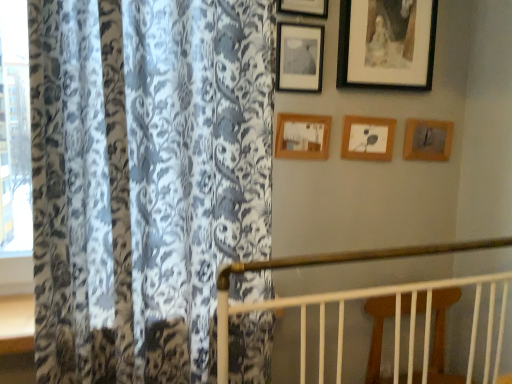
Question: Is wooden picture frame at upper center, the fifth picture frame when ordered from right to left, with wooden picture frame at upper center, the 4th picture frame when ordered from left to right?

Choices:
 (A) no
 (B) yes

Answer: (A)

Question: Is the depth of wooden picture frame at upper center, the fifth picture frame when ordered from right to left, less than that of wooden picture frame at upper center, positioned as the 3th picture frame in right-to-left order?

Choices:
 (A) yes
 (B) no

Answer: (A)

Question: Is wooden picture frame at upper center, which is the second picture frame from left to right, wider than wooden picture frame at upper center, positioned as the 3th picture frame in right-to-left order?

Choices:
 (A) no
 (B) yes

Answer: (B)

Question: From a real-world perspective, is wooden picture frame at upper center, which is the second picture frame from left to right, positioned under wooden picture frame at upper center, positioned as the 3th picture frame in right-to-left order, based on gravity?

Choices:
 (A) yes
 (B) no

Answer: (B)

Question: Does wooden picture frame at upper center, the fifth picture frame when ordered from right to left, appear on the left side of wooden picture frame at upper center, the 4th picture frame when ordered from left to right?

Choices:
 (A) no
 (B) yes

Answer: (B)

Question: Considering the positions of floral-patterned fabric at left and black matte picture frame at upper right, positioned as the second picture frame in right-to-left order, in the image, is floral-patterned fabric at left bigger or smaller than black matte picture frame at upper right, positioned as the second picture frame in right-to-left order,?

Choices:
 (A) small
 (B) big

Answer: (B)

Question: In the image, is floral-patterned fabric at left positioned in front of or behind black matte picture frame at upper right, positioned as the second picture frame in right-to-left order?

Choices:
 (A) front
 (B) behind

Answer: (A)

Question: In terms of width, does floral-patterned fabric at left look wider or thinner when compared to black matte picture frame at upper right, the 5th picture frame positioned from the left?

Choices:
 (A) thin
 (B) wide

Answer: (B)

Question: In terms of height, does floral-patterned fabric at left look taller or shorter compared to black matte picture frame at upper right, positioned as the second picture frame in right-to-left order?

Choices:
 (A) tall
 (B) short

Answer: (A)

Question: From the image's perspective, is matte black picture frame at upper center, the first picture frame when ordered from left to right, located above or below wooden picture frame at center, positioned as the 3th picture frame in left-to-right order?

Choices:
 (A) below
 (B) above

Answer: (B)

Question: From their relative heights in the image, would you say matte black picture frame at upper center, which appears as the 6th picture frame when viewed from the right, is taller or shorter than wooden picture frame at center, positioned as the 3th picture frame in left-to-right order?

Choices:
 (A) short
 (B) tall

Answer: (B)

Question: From a real-world perspective, is matte black picture frame at upper center, the first picture frame when ordered from left to right, positioned above or below wooden picture frame at center, positioned as the 3th picture frame in left-to-right order?

Choices:
 (A) below
 (B) above

Answer: (B)

Question: In terms of width, does matte black picture frame at upper center, which appears as the 6th picture frame when viewed from the right, look wider or thinner when compared to wooden picture frame at center, marked as the fourth picture frame in a right-to-left arrangement?

Choices:
 (A) wide
 (B) thin

Answer: (B)

Question: Is point (327, 6) positioned closer to the camera than point (245, 226)?

Choices:
 (A) closer
 (B) farther

Answer: (B)

Question: Is wooden picture frame at upper center, which is the second picture frame from left to right, in front of or behind floral-patterned fabric at left in the image?

Choices:
 (A) behind
 (B) front

Answer: (A)